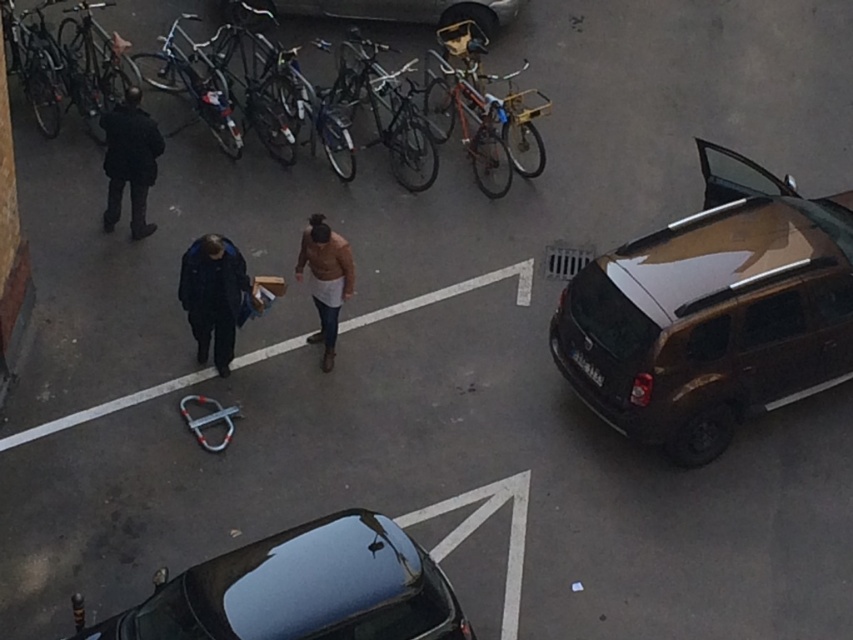
Is shiny brown minivan at right above light brown leather jacket at center?

No, shiny brown minivan at right is not above light brown leather jacket at center.

Locate an element on the screen. The height and width of the screenshot is (640, 853). shiny brown minivan at right is located at coordinates (712, 312).

Where is `shiny brown minivan at right`? shiny brown minivan at right is located at coordinates (712, 312).

Does point (321, 108) come farther from viewer compared to point (334, 262)?

Yes, it is.

Who is more forward, (x=167, y=65) or (x=331, y=323)?

Point (x=331, y=323)

Where is `shiny silver bicycle at upper left`? This screenshot has height=640, width=853. shiny silver bicycle at upper left is located at coordinates (294, 92).

The width and height of the screenshot is (853, 640). I want to click on shiny silver bicycle at upper left, so click(x=294, y=92).

Where is `metallic silver van at upper center`? metallic silver van at upper center is located at coordinates (403, 10).

Is point (283, 8) in front of point (318, 252)?

No, (283, 8) is further to viewer.

Find the location of a particular element. metallic silver van at upper center is located at coordinates (403, 10).